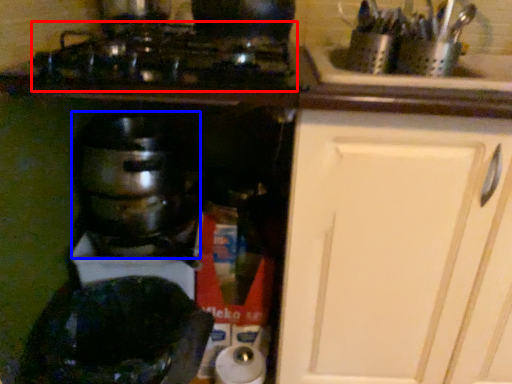
Question: Which of the following is the closest to the observer, gas stove (highlighted by a red box) or kitchen appliance (highlighted by a blue box)?

Choices:
 (A) gas stove
 (B) kitchen appliance

Answer: (A)